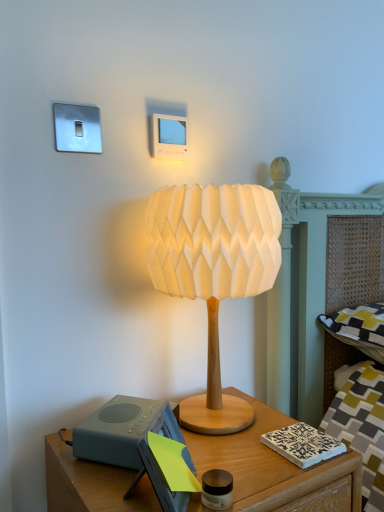
You are a GUI agent. You are given a task and a screenshot of the screen. Output one action in this format:
    pyautogui.click(x=<x>, y=<y>)
    Task: Click on the free space in front of white paper lampshade at center
    Image resolution: width=384 pixels, height=512 pixels.
    Given the screenshot: What is the action you would take?
    pyautogui.click(x=240, y=470)